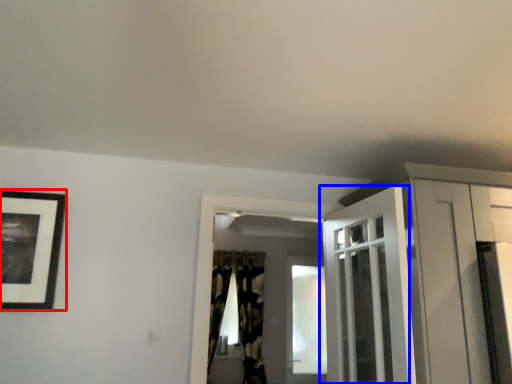
Question: Which of the following is the farthest to the observer, picture frame (highlighted by a red box) or door (highlighted by a blue box)?

Choices:
 (A) picture frame
 (B) door

Answer: (A)